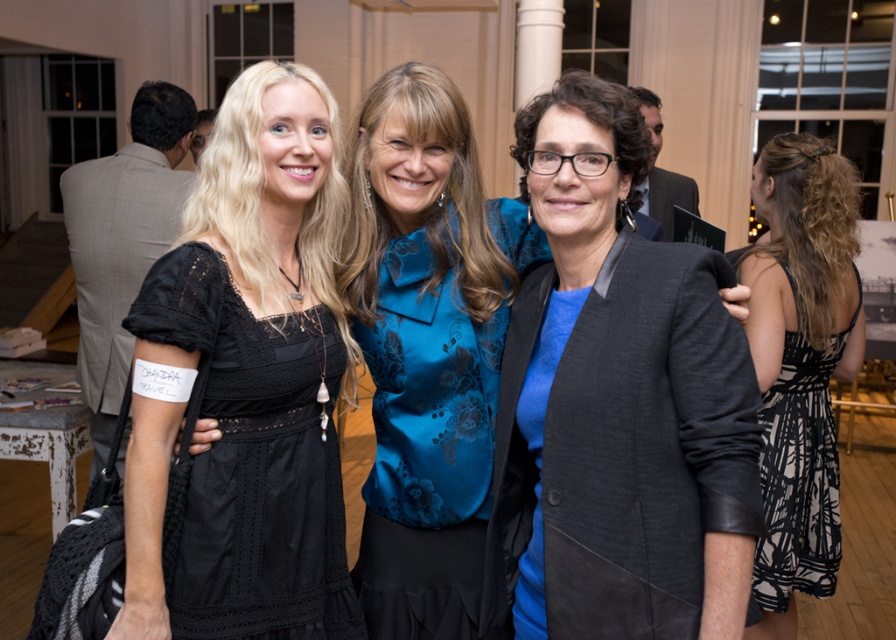
Question: Considering the real-world distances, which object is farthest from the blue satin blouse at center?

Choices:
 (A) black printed fabric dress at right
 (B) black lace dress at center
 (C) matte black blazer at center

Answer: (A)

Question: Which object is the closest to the blue satin blouse at center?

Choices:
 (A) matte black blazer at center
 (B) black printed fabric dress at right
 (C) black lace dress at center

Answer: (C)

Question: Can you confirm if matte black blazer at center is positioned to the right of black printed fabric dress at right?

Choices:
 (A) yes
 (B) no

Answer: (B)

Question: Estimate the real-world distances between objects in this image. Which object is farther from the blue satin blouse at center?

Choices:
 (A) matte black blazer at center
 (B) black printed fabric dress at right
 (C) black lace dress at center

Answer: (B)

Question: Can you confirm if matte black blazer at center is thinner than blue satin blouse at center?

Choices:
 (A) no
 (B) yes

Answer: (B)

Question: Is black lace dress at center thinner than blue satin blouse at center?

Choices:
 (A) no
 (B) yes

Answer: (B)